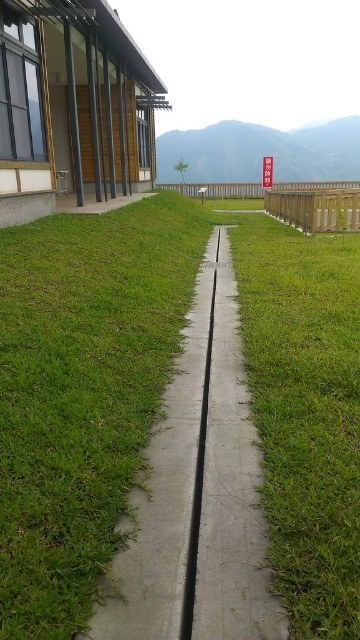
You are a gardener who needs to place a 1.2 meter wide decorative stone along the pathway. The concrete at center and wooden fence at right are nearby. Which object can the stone fit next to without overlapping?

The concrete at center is thinner than the wooden fence at right, so the 1.2 meter wide decorative stone can fit next to the concrete at center without overlapping since it has more space available.

You are standing at the entrance of the modern building on the left side of the image. You want to walk to the wooden railing in the background. Is the concrete at center in your path?

The concrete at center is located at point [199,493], so yes, the concrete at center is in your path between the modern building and the wooden railing.